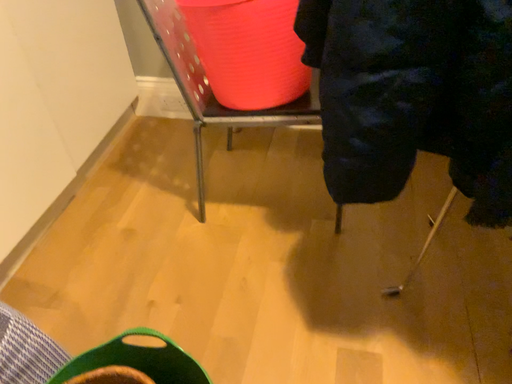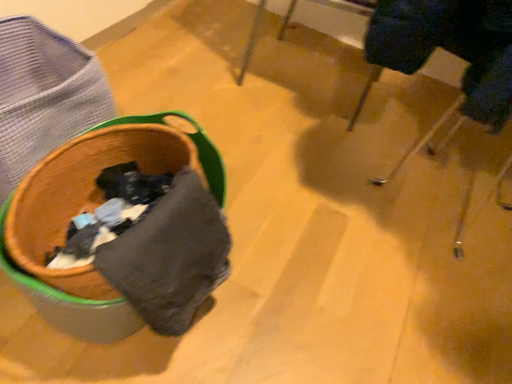
Question: Which way did the camera rotate in the video?

Choices:
 (A) rotated upward
 (B) rotated downward

Answer: (B)